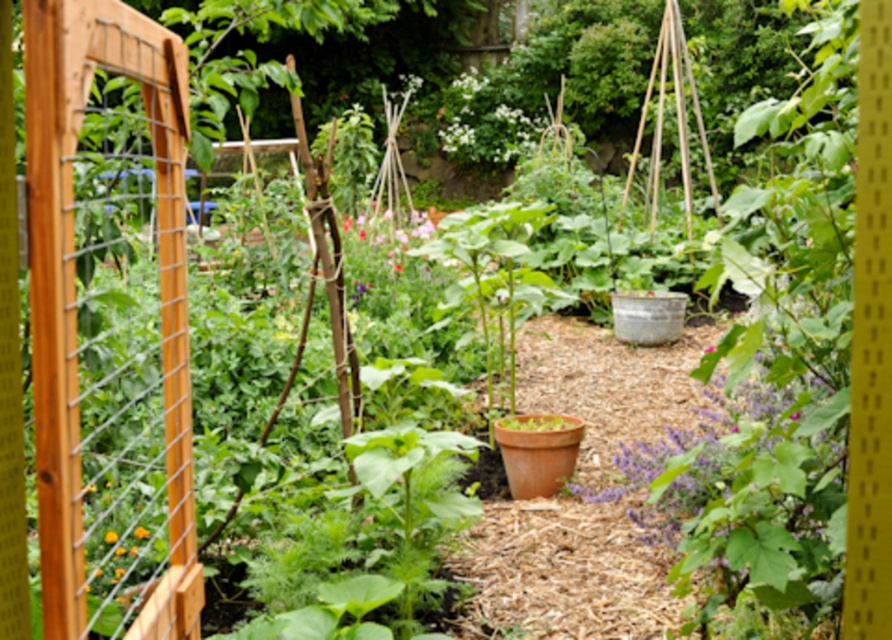
Question: Which point is closer to the camera?

Choices:
 (A) pink matte flower at center
 (B) orange matte flower at center

Answer: (B)

Question: Does pink matte flower at center appear over orange matte flower at center?

Choices:
 (A) no
 (B) yes

Answer: (B)

Question: Can you confirm if pink matte flower at center is positioned below orange matte flower at center?

Choices:
 (A) no
 (B) yes

Answer: (A)

Question: Which point is farther from the camera taking this photo?

Choices:
 (A) pyautogui.click(x=358, y=264)
 (B) pyautogui.click(x=106, y=536)

Answer: (A)

Question: Can you confirm if pink matte flower at center is smaller than orange matte flower at center?

Choices:
 (A) yes
 (B) no

Answer: (B)

Question: Which object is closer to the camera taking this photo?

Choices:
 (A) pink matte flower at center
 (B) orange matte flower at center

Answer: (B)